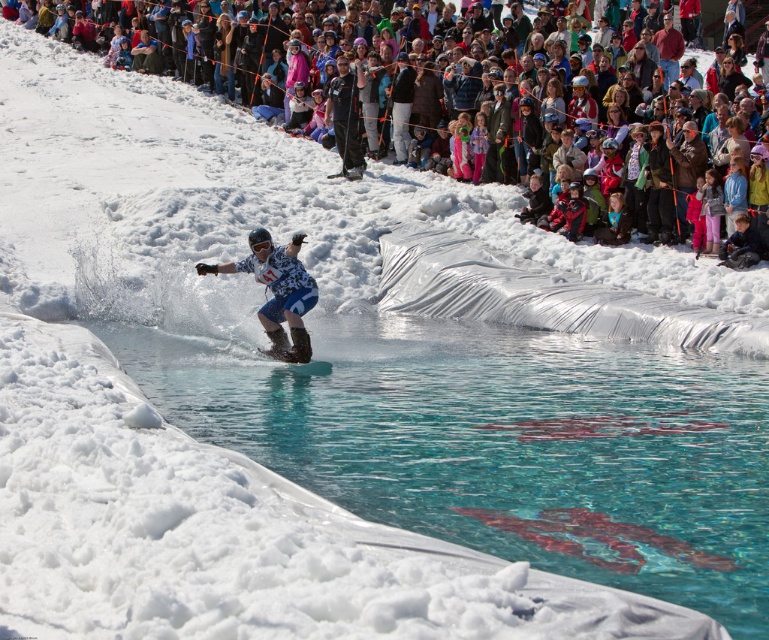
You are a photographer at the snowboarding event. You need to capture a photo where both the multicolored fabric crowd at upper center and the transparent plastic ramp at center are visible. Which object should you focus on to ensure both are in frame?

You should focus on the transparent plastic ramp at center because the multicolored fabric crowd at upper center is bigger than transparent plastic ramp at center, so the ramp will fit within the frame while still including the crowd.

You are a drone operator trying to capture the best aerial shot of the snowboarder and the crowd. The snowboarder is currently midair above the water pool, and the crowd is at point (248,196). To ensure both are in frame, where should you position the drone relative to the snowboarder and the crowd?

The multicolored fabric crowd at upper center is located at point (248,196). Position the drone between the snowboarder and the crowd to ensure both are in frame.